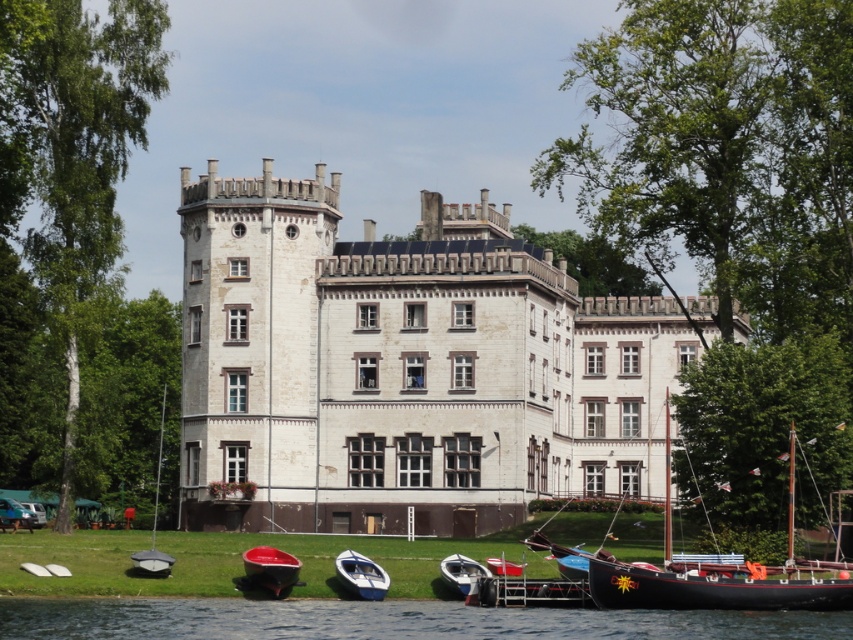
Who is positioned more to the right, transparent water at lower center or shiny red boat at lower center?

transparent water at lower center

Does transparent water at lower center appear over shiny red boat at lower center?

Actually, transparent water at lower center is below shiny red boat at lower center.

The image size is (853, 640). What are the coordinates of `transparent water at lower center` in the screenshot? It's located at (387, 620).

At what (x,y) coordinates should I click in order to perform the action: click on transparent water at lower center. Please return your answer as a coordinate pair (x, y). The image size is (853, 640). Looking at the image, I should click on (387, 620).

Is point (759, 564) positioned behind point (370, 568)?

No.

Can you confirm if wooden sailboat at lower right is positioned to the right of white glossy boat at lower center?

Indeed, wooden sailboat at lower right is positioned on the right side of white glossy boat at lower center.

Does point (724, 554) lie in front of point (367, 576)?

No, (724, 554) is behind (367, 576).

You are a GUI agent. You are given a task and a screenshot of the screen. Output one action in this format:
    pyautogui.click(x=<x>, y=<y>)
    Task: Click on the wooden sailboat at lower right
    This screenshot has width=853, height=640.
    Given the screenshot: What is the action you would take?
    pyautogui.click(x=724, y=577)

Is wooden sailboat at lower right shorter than metallic red boat at lower center?

No, wooden sailboat at lower right is not shorter than metallic red boat at lower center.

The height and width of the screenshot is (640, 853). Describe the element at coordinates (724, 577) in the screenshot. I see `wooden sailboat at lower right` at that location.

At what (x,y) coordinates should I click in order to perform the action: click on wooden sailboat at lower right. Please return your answer as a coordinate pair (x, y). Looking at the image, I should click on (724, 577).